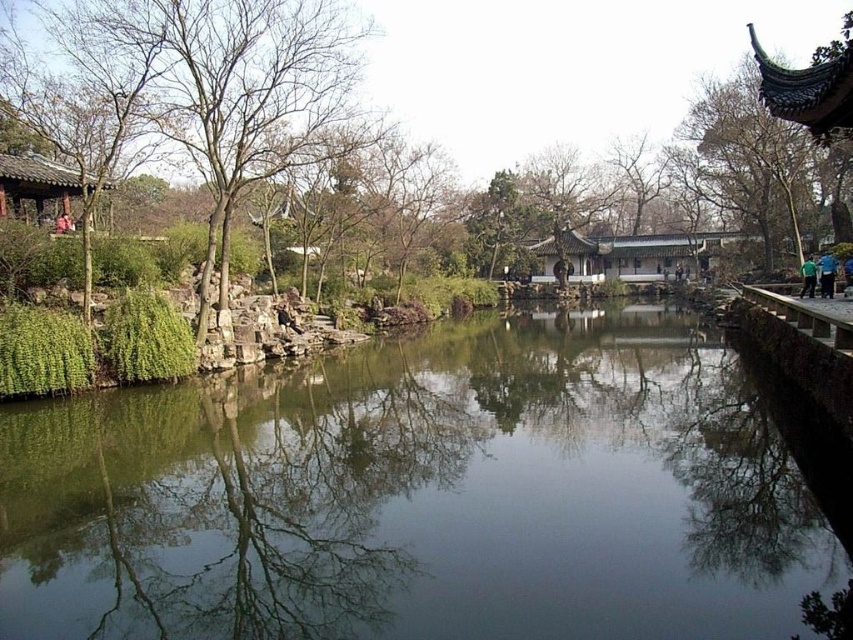
Question: Is green stone river at center below green leafy tree at left?

Choices:
 (A) yes
 (B) no

Answer: (A)

Question: Does green stone river at center have a lesser width compared to green leafy tree at left?

Choices:
 (A) yes
 (B) no

Answer: (A)

Question: From the image, what is the correct spatial relationship of green stone river at center in relation to green leafy tree at left?

Choices:
 (A) left
 (B) right

Answer: (A)